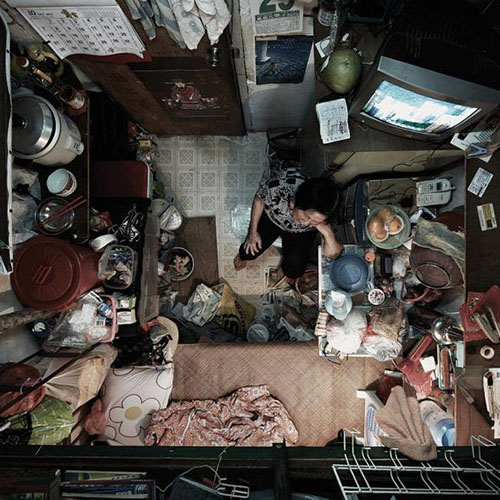
Where is `linoleum`? The width and height of the screenshot is (500, 500). linoleum is located at coordinates (213, 181).